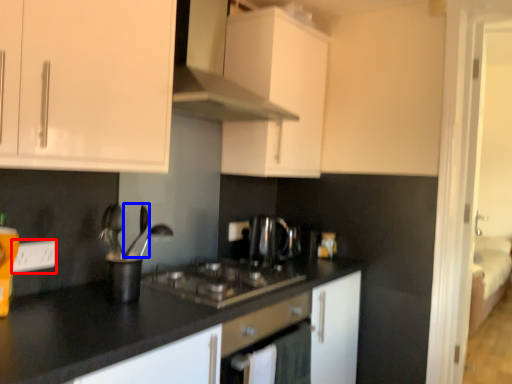
Question: Which of the following is the closest to the observer, electric outlet (highlighted by a red box) or silverware (highlighted by a blue box)?

Choices:
 (A) electric outlet
 (B) silverware

Answer: (A)